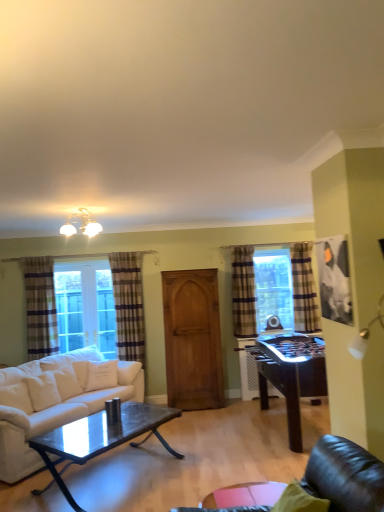
Question: From their relative heights in the image, would you say plaid fabric curtain at center, which is the 3th curtain from left to right, is taller or shorter than transparent glass table at lower center?

Choices:
 (A) tall
 (B) short

Answer: (A)

Question: Considering their positions, is plaid fabric curtain at center, which is the 3th curtain from left to right, located in front of or behind transparent glass table at lower center?

Choices:
 (A) front
 (B) behind

Answer: (B)

Question: Which of these objects is positioned closest to the transparent glass table at lower center?

Choices:
 (A) matte white chandelier at upper center
 (B) wooden armoire at center
 (C) plaid fabric curtain at center, which is the 3th curtain from left to right
 (D) plaid fabric curtain at left, the 4th curtain from the right
 (E) white cotton pillow at lower left, the second pillow when ordered from front to back

Answer: (E)

Question: Which object is positioned farthest from the transparent glass table at lower center?

Choices:
 (A) plaid fabric curtain at left, arranged as the 1th curtain when viewed from the left
 (B) wooden armoire at center
 (C) plaid fabric curtain at left, the third curtain in the right-to-left sequence
 (D) white fabric couch at lower left
 (E) plaid fabric curtain at right, the first curtain from the right

Answer: (A)